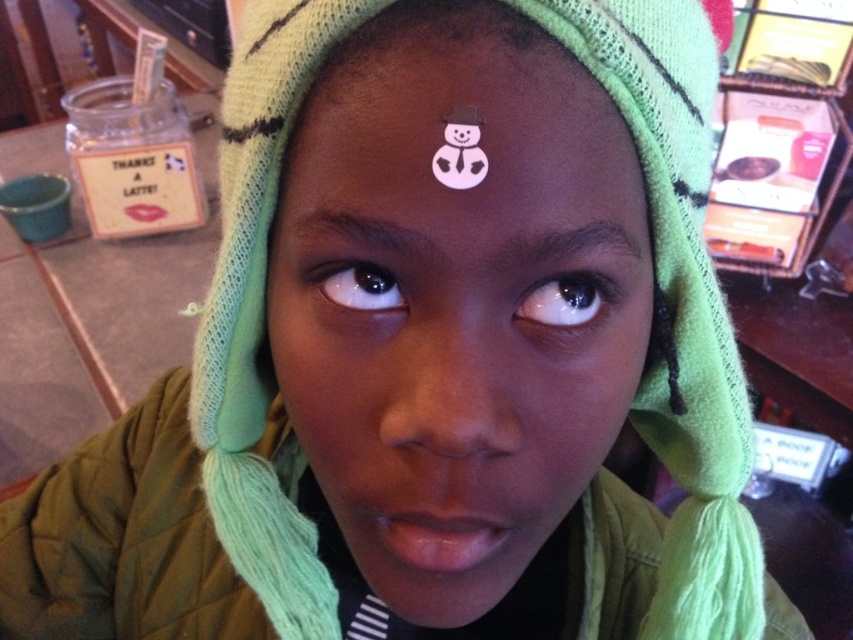
Question: Can you confirm if white paper snowman at center is positioned to the left of black glossy eye at center?

Choices:
 (A) no
 (B) yes

Answer: (B)

Question: Does white paper snowman at center lie behind black glossy eye at center?

Choices:
 (A) no
 (B) yes

Answer: (A)

Question: Does pink paper snowman at center have a larger size compared to brown matte eye at center?

Choices:
 (A) yes
 (B) no

Answer: (A)

Question: Which point is farther to the camera?

Choices:
 (A) black glossy eye at center
 (B) brown matte eye at center
 (C) white paper snowman at center

Answer: (B)

Question: Which object is the closest to the pink paper snowman at center?

Choices:
 (A) white paper snowman at center
 (B) brown matte eye at center

Answer: (A)

Question: Which object appears closest to the camera in this image?

Choices:
 (A) pink paper snowman at center
 (B) white paper snowman at center

Answer: (B)